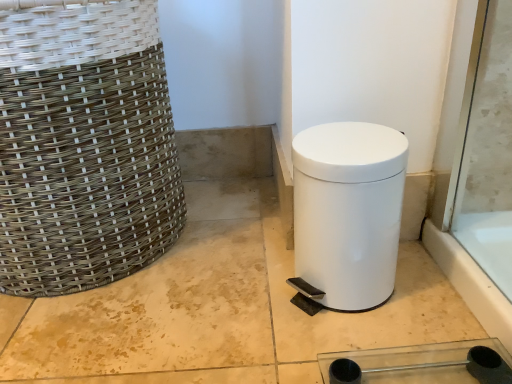
The height and width of the screenshot is (384, 512). Identify the location of unoccupied region to the right of white glossy trash can at lower right. (431, 297).